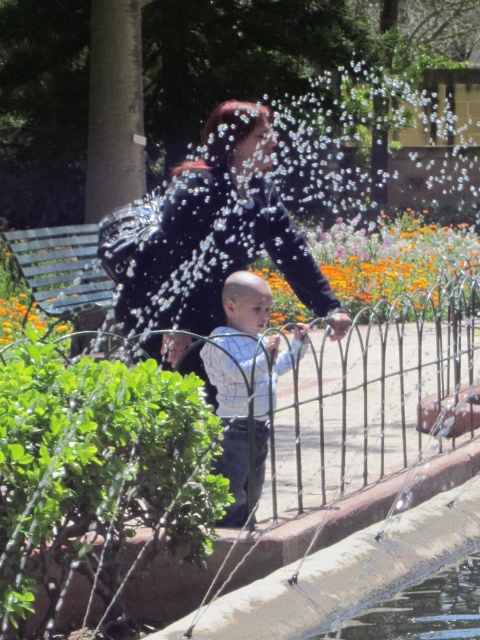
Can you confirm if light blue striped shirt at center is bigger than green metal bench at left?

No.

Between point (231, 310) and point (108, 348), which one is positioned in front?

Point (231, 310) is in front.

What do you see at coordinates (244, 381) in the screenshot? This screenshot has width=480, height=640. I see `light blue striped shirt at center` at bounding box center [244, 381].

At what (x,y) coordinates should I click in order to perform the action: click on light blue striped shirt at center. Please return your answer as a coordinate pair (x, y). Image resolution: width=480 pixels, height=640 pixels. Looking at the image, I should click on (244, 381).

Can you confirm if matte black jacket at center is positioned below light blue striped shirt at center?

Actually, matte black jacket at center is above light blue striped shirt at center.

Find the location of a particular element. matte black jacket at center is located at coordinates (208, 234).

Identify the location of matte black jacket at center. The image size is (480, 640). (208, 234).

Between matte black jacket at center and green metal bench at left, which one appears on the right side from the viewer's perspective?

Positioned to the right is matte black jacket at center.

Is point (187, 180) positioned before point (85, 236)?

That is True.

What do you see at coordinates (208, 234) in the screenshot?
I see `matte black jacket at center` at bounding box center [208, 234].

Where is `matte black jacket at center`? matte black jacket at center is located at coordinates (208, 234).